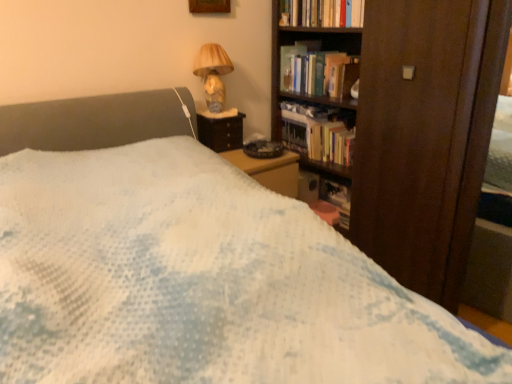
This screenshot has height=384, width=512. What are the coordinates of `vacant space underneath matte glass table lamp at upper right (from a real-world perspective)` in the screenshot? It's located at [218, 111].